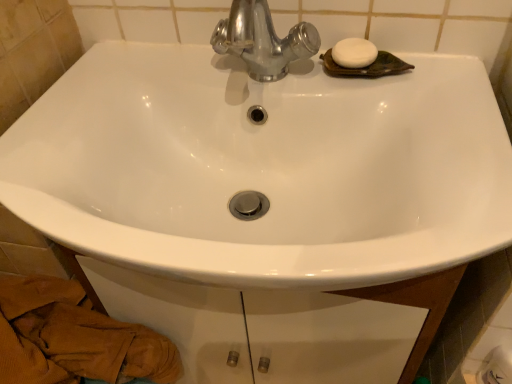
Where is `free space in front of white matte soap at upper right`? The image size is (512, 384). free space in front of white matte soap at upper right is located at coordinates (443, 114).